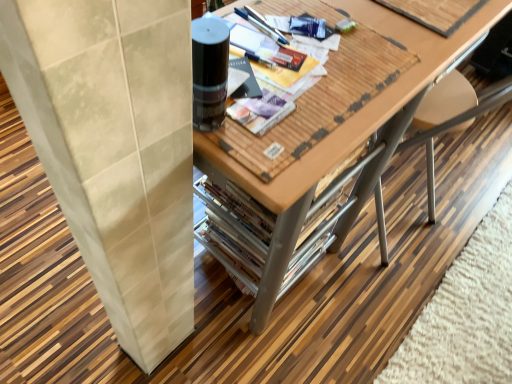
Find the location of a particular element. The width and height of the screenshot is (512, 384). free space above wooden table at center (from a real-world perspective) is located at coordinates (332, 43).